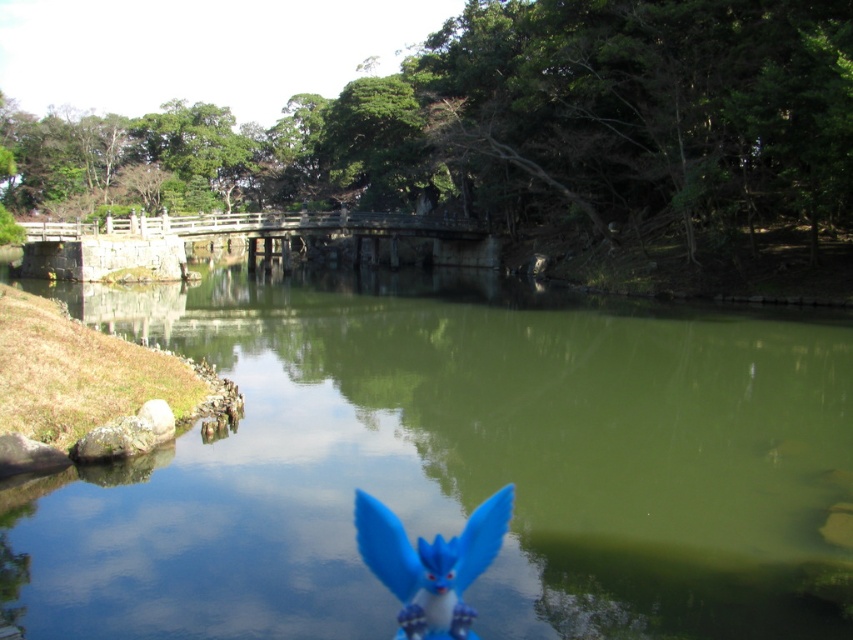
You are standing on the stone bridge at center and want to see the green matte water at center. In which direction should you look?

You should look to the right to see the green matte water at center, as it is positioned to the right of the stone bridge at center.

In the scene shown: You are standing at the edge of the water in the serene natural scene. You see two points marked in the image. Which point is closer to you, point (560, 632) or point (405, 540)?

Point (560, 632) is further to the viewer than point (405, 540), so the closer point to you is point (405, 540).